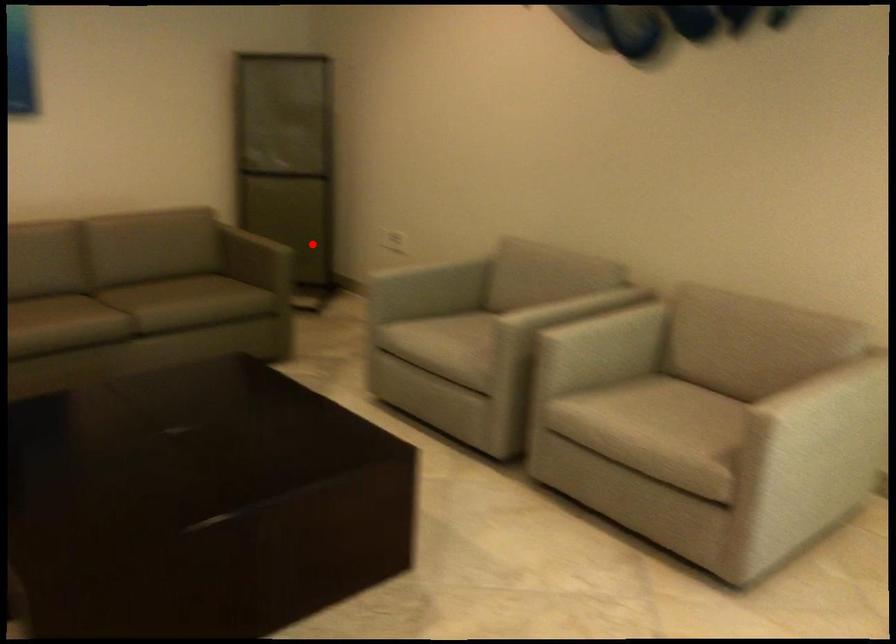
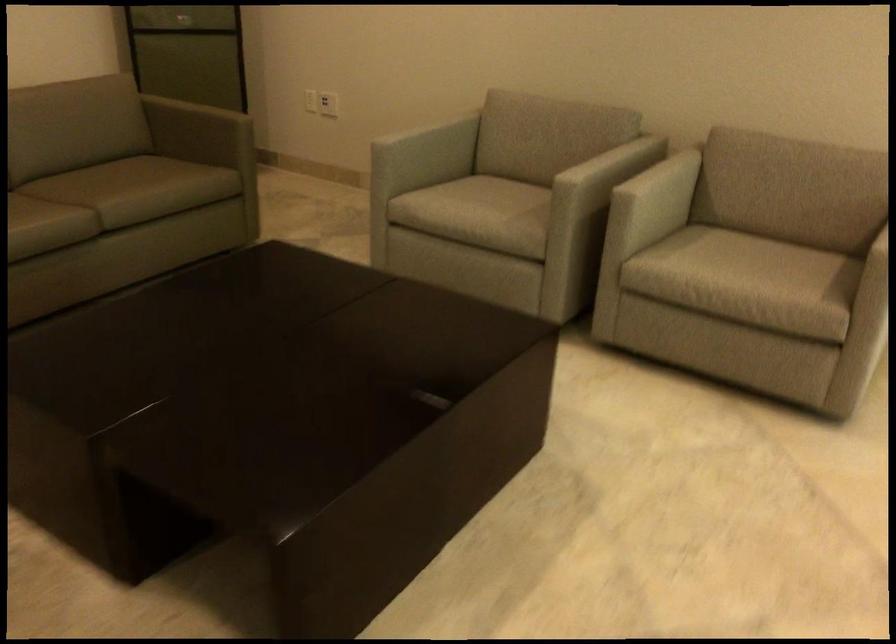
Question: A red point is marked in image1. In image2, is the corresponding 3D point closer to the camera or farther? Reply with the corresponding letter.

Choices:
 (A) The corresponding 3D point is closer.
 (B) The corresponding 3D point is farther.

Answer: (A)